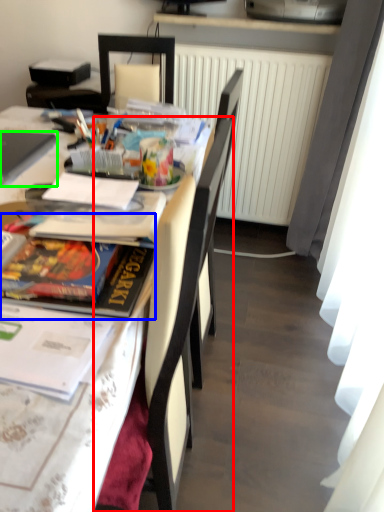
Question: Which is nearer to the chair (highlighted by a red box)? magazine (highlighted by a blue box) or laptop (highlighted by a green box).

Choices:
 (A) magazine
 (B) laptop

Answer: (A)